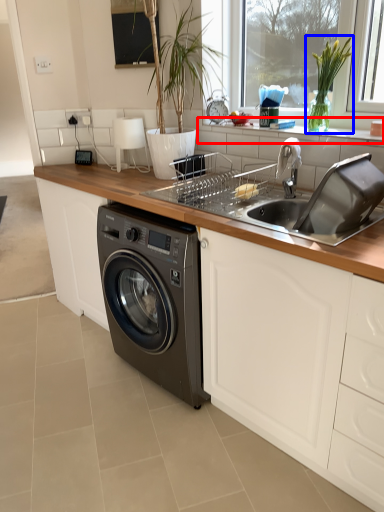
Question: Which of the following is the closest to the observer, window sill (highlighted by a red box) or plant (highlighted by a blue box)?

Choices:
 (A) window sill
 (B) plant

Answer: (A)